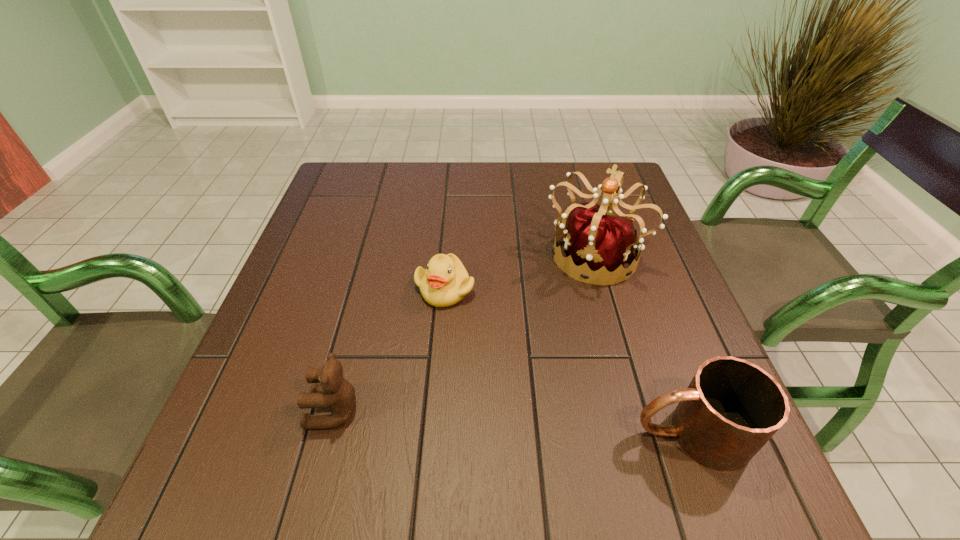
The image size is (960, 540). I want to click on vacant space located 0.080m on the side of the mug with the handle, so click(586, 434).

Locate an element on the screen. The width and height of the screenshot is (960, 540). vacant area situated on the front-facing side of the tallest object is located at coordinates (544, 349).

Identify the location of vacant space located on the front-facing side of the tallest object. The image size is (960, 540). (548, 342).

Find the location of `vacant point located on the front-facing side of the tallest object`. vacant point located on the front-facing side of the tallest object is located at coordinates (511, 414).

Where is `vacant position located on the front-facing side of the second object from left to right`? The image size is (960, 540). vacant position located on the front-facing side of the second object from left to right is located at coordinates (448, 327).

Locate an element on the screen. vacant space located 0.280m on the front-facing side of the second object from left to right is located at coordinates (457, 431).

Find the location of a particular element. free region located on the front-facing side of the second object from left to right is located at coordinates point(457,426).

At what (x,y) coordinates should I click in order to perform the action: click on teddy bear positioned at the near edge. Please return your answer as a coordinate pair (x, y). The image size is (960, 540). Looking at the image, I should click on (335, 392).

Identify the location of mug at the near edge. The height and width of the screenshot is (540, 960). (731, 408).

Identify the location of object that is at the left edge. 335,392.